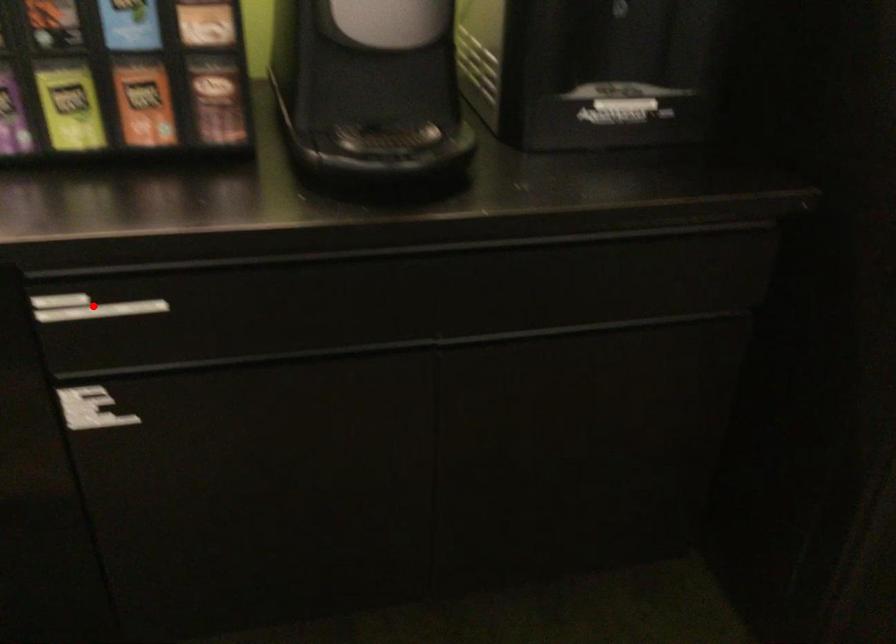
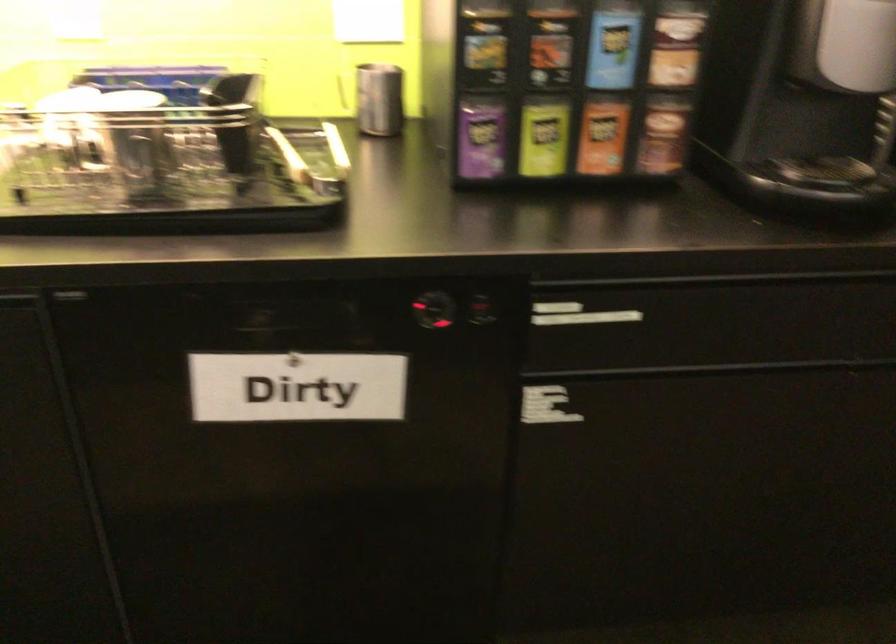
Question: I am providing you with two images of the same scene from different viewpoints. Image1 has a red point marked. In image2, the corresponding 3D location appears at what relative position? Reply with the corresponding letter.

Choices:
 (A) Closer
 (B) Farther

Answer: (B)